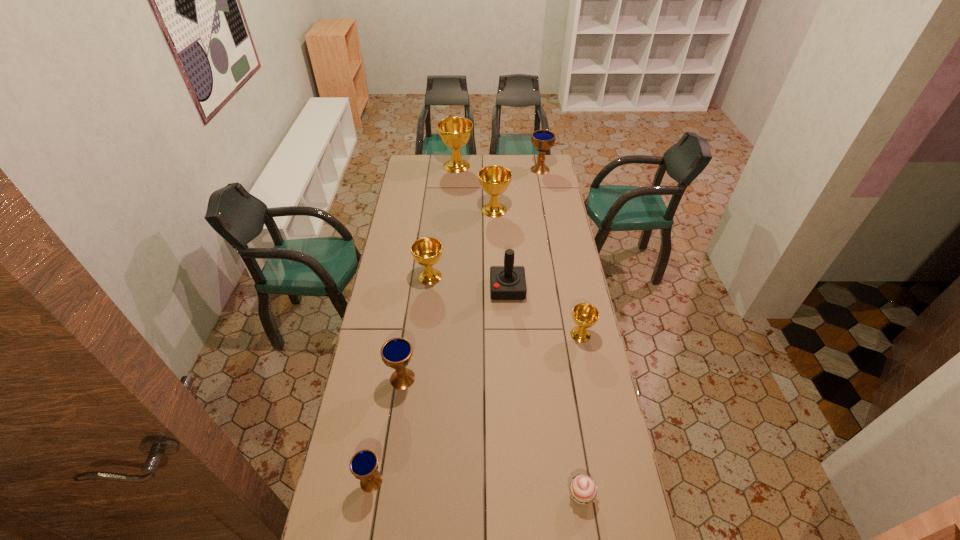
I want to click on the tallest object, so click(x=455, y=132).

The height and width of the screenshot is (540, 960). In order to click on the farthest gold chalice in this screenshot , I will do point(455,132).

Identify the location of the rightmost blue chalice. (543, 140).

Locate an element on the screen. the biggest blue chalice is located at coordinates (543, 140).

Identify the location of the third smallest gold chalice. The height and width of the screenshot is (540, 960). (494, 180).

The height and width of the screenshot is (540, 960). What are the coordinates of `the third nearest gold chalice` in the screenshot? It's located at click(x=494, y=180).

Identify the location of red joystick. (508, 282).

Find the location of a particular element. the second nearest blue chalice is located at coordinates coord(396,353).

Where is `the second nearest chalice`? The height and width of the screenshot is (540, 960). the second nearest chalice is located at coordinates (396, 353).

The height and width of the screenshot is (540, 960). Identify the location of the third biggest gold chalice. (427, 251).